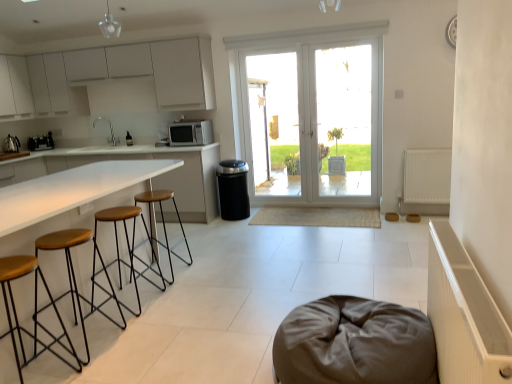
This screenshot has height=384, width=512. I want to click on vacant point to the right of white matte countertop at left, so click(x=241, y=279).